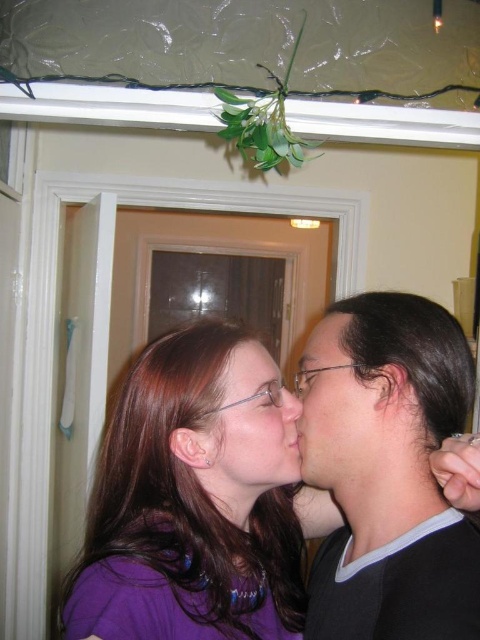
Between matte black face at center and matte purple shirt at center, which one is positioned higher?

matte black face at center is higher up.

Does matte black face at center have a lesser width compared to matte purple shirt at center?

Yes.

Does point (322, 426) come in front of point (252, 372)?

No, it is behind (252, 372).

Image resolution: width=480 pixels, height=640 pixels. In order to click on matte black face at center in this screenshot , I will do `click(338, 412)`.

Does purple matte shirt at center appear on the left side of matte purple shirt at center?

Yes, purple matte shirt at center is to the left of matte purple shirt at center.

Can you confirm if purple matte shirt at center is positioned above matte purple shirt at center?

Actually, purple matte shirt at center is below matte purple shirt at center.

Is point (235, 413) positioned after point (236, 397)?

No.

At what (x,y) coordinates should I click in order to perform the action: click on purple matte shirt at center. Please return your answer as a coordinate pair (x, y). Looking at the image, I should click on (193, 499).

In the scene shown: Is black matte hair at right above matte black hair at center?

No.

I want to click on black matte hair at right, so 394,476.

Locate an element on the screen. black matte hair at right is located at coordinates (394, 476).